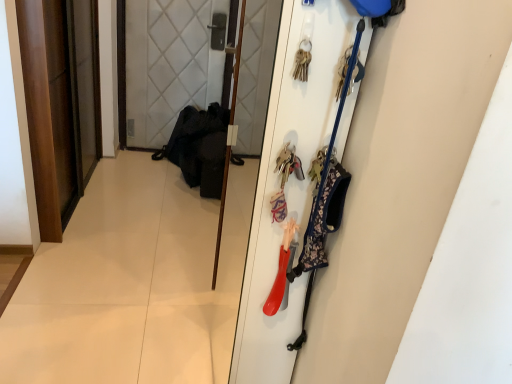
Image resolution: width=512 pixels, height=384 pixels. I want to click on vacant region to the left of wooden screen door at center, so click(147, 224).